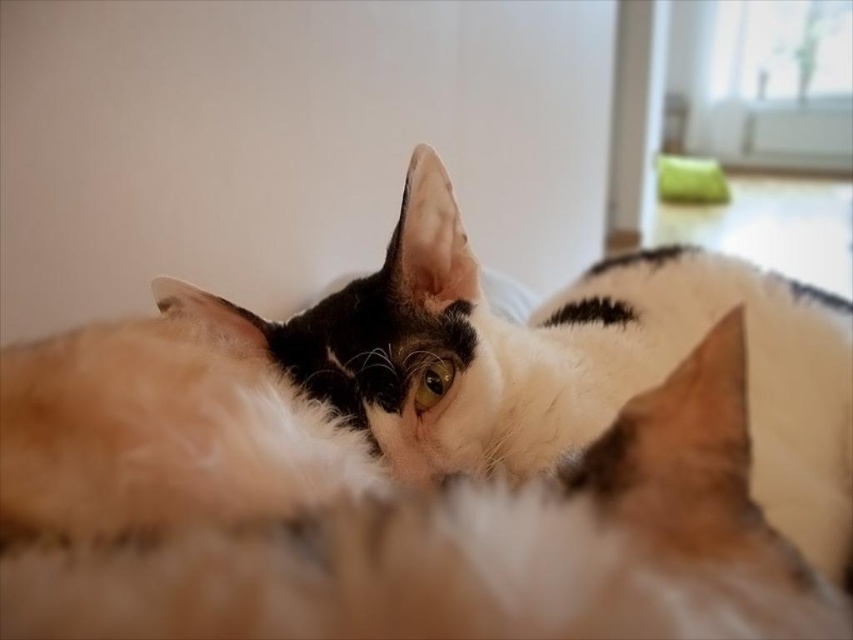
You are a photographer aiming to capture a close portrait of the fluffy white cat at center. Given that the camera is focused at point (566,362), will the cat be in focus?

Yes, the camera is focused at point (566,362) where the fluffy white cat at center is located, so the cat will be in focus.

Looking at this image, you are a photographer trying to capture a portrait of the fluffy white cat at center and the green fabric pillow at upper right. Since the pillow is part of the background, you want to ensure it doesn not distract from the cat. Given their heights, which one should you focus on to keep the other slightly blurred?

The fluffy white cat at center is taller than the green fabric pillow at upper right. To keep the pillow blurred while focusing on the cat, you should adjust your camera to focus on the taller subject, which is the fluffy white cat at center.

You are trying to place a new toy between the fluffy white cat at center and the green fabric pillow at upper right. Based on their sizes, which one do you think requires more space horizontally?

The fluffy white cat at center requires more horizontal space because its width surpasses that of the green fabric pillow at upper right.